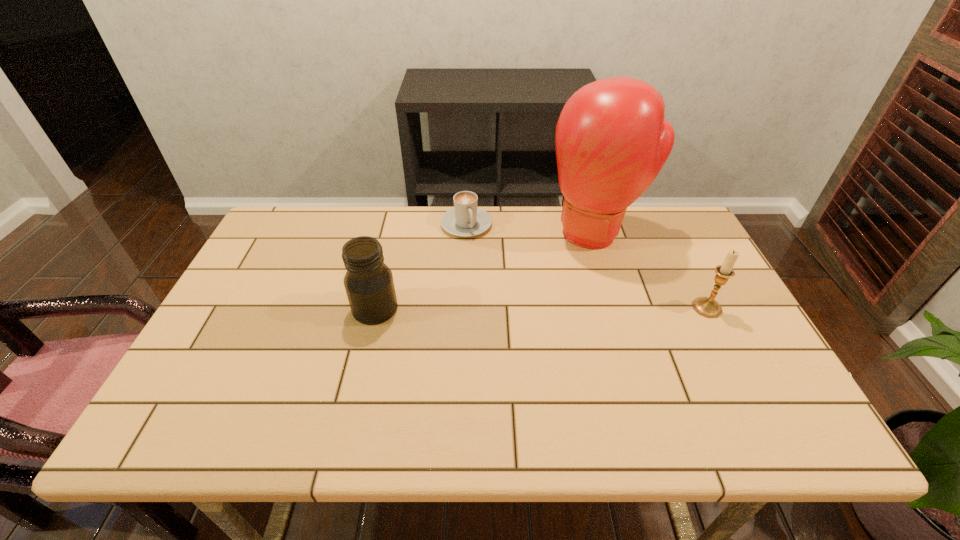
Find the location of a particular element. This screenshot has height=540, width=960. vacant spot on the desktop that is between the leftmost object and the rightmost object and is positioned to the right of the shortest object is located at coordinates (506, 308).

The image size is (960, 540). Find the location of `free space on the desktop that is between the jar and the candle holder and is positioned on the striking surface of the tallest object`. free space on the desktop that is between the jar and the candle holder and is positioned on the striking surface of the tallest object is located at coordinates (560, 308).